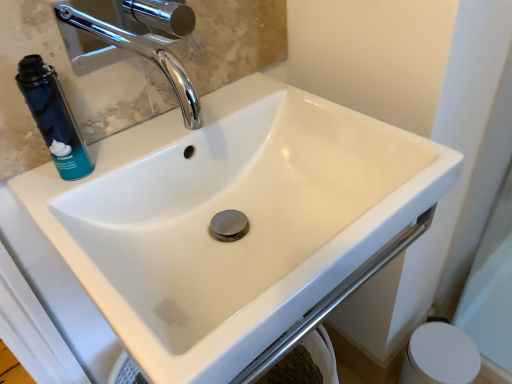
Question: Is white matte toilet paper at lower right facing towards matte glass mirror at upper left?

Choices:
 (A) no
 (B) yes

Answer: (A)

Question: From the image's perspective, is white matte toilet paper at lower right below matte glass mirror at upper left?

Choices:
 (A) yes
 (B) no

Answer: (A)

Question: Is white matte toilet paper at lower right oriented away from matte glass mirror at upper left?

Choices:
 (A) yes
 (B) no

Answer: (B)

Question: Considering the relative positions of white matte toilet paper at lower right and matte glass mirror at upper left in the image provided, is white matte toilet paper at lower right to the left of matte glass mirror at upper left from the viewer's perspective?

Choices:
 (A) yes
 (B) no

Answer: (B)

Question: Does white matte toilet paper at lower right have a greater height compared to matte glass mirror at upper left?

Choices:
 (A) yes
 (B) no

Answer: (A)

Question: Is white matte toilet paper at lower right bigger or smaller than blue matte can at upper left?

Choices:
 (A) small
 (B) big

Answer: (B)

Question: Visually, is white matte toilet paper at lower right positioned to the left or to the right of blue matte can at upper left?

Choices:
 (A) right
 (B) left

Answer: (A)

Question: From the image's perspective, is white matte toilet paper at lower right positioned above or below blue matte can at upper left?

Choices:
 (A) below
 (B) above

Answer: (A)

Question: Is white matte toilet paper at lower right inside the boundaries of blue matte can at upper left, or outside?

Choices:
 (A) inside
 (B) outside

Answer: (B)

Question: Considering the positions of matte glass mirror at upper left and blue matte can at upper left in the image, is matte glass mirror at upper left bigger or smaller than blue matte can at upper left?

Choices:
 (A) small
 (B) big

Answer: (B)

Question: Is point (207, 61) closer or farther from the camera than point (54, 119)?

Choices:
 (A) farther
 (B) closer

Answer: (A)

Question: From a real-world perspective, relative to blue matte can at upper left, is matte glass mirror at upper left vertically above or below?

Choices:
 (A) below
 (B) above

Answer: (B)

Question: Is matte glass mirror at upper left in front of or behind blue matte can at upper left in the image?

Choices:
 (A) front
 (B) behind

Answer: (A)

Question: Is point (36, 56) positioned closer to the camera than point (419, 352)?

Choices:
 (A) closer
 (B) farther

Answer: (A)

Question: From a real-world perspective, is blue matte can at upper left positioned above or below white matte toilet paper at lower right?

Choices:
 (A) above
 (B) below

Answer: (A)